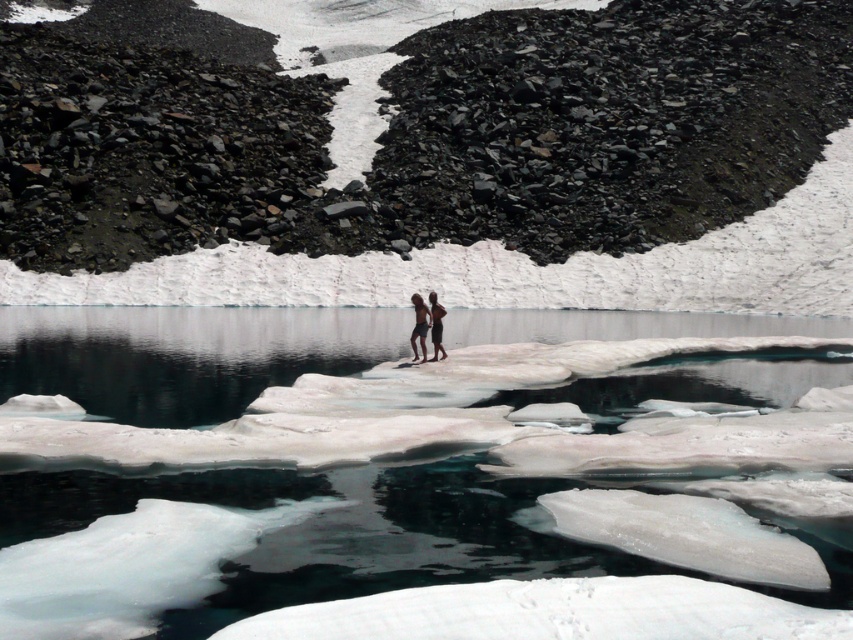
Can you confirm if clear ice at center is thinner than tan skin at center?

No, clear ice at center is not thinner than tan skin at center.

Between clear ice at center and tan skin at center, which one is positioned lower?

clear ice at center

The image size is (853, 640). I want to click on clear ice at center, so click(x=383, y=458).

Does tan skin at center appear over skinny jeans at center?

No.

Does tan skin at center have a smaller size compared to skinny jeans at center?

Actually, tan skin at center might be larger than skinny jeans at center.

Locate an element on the screen. The image size is (853, 640). tan skin at center is located at coordinates (419, 324).

Find the location of `tan skin at center`. tan skin at center is located at coordinates (419, 324).

Does clear ice at center have a lesser height compared to skinny jeans at center?

Incorrect, clear ice at center's height does not fall short of skinny jeans at center's.

Between clear ice at center and skinny jeans at center, which one has more height?

With more height is clear ice at center.

Which is in front, point (50, 410) or point (434, 308)?

Point (50, 410)

You are a GUI agent. You are given a task and a screenshot of the screen. Output one action in this format:
    pyautogui.click(x=<x>, y=<y>)
    Task: Click on the clear ice at center
    The image size is (853, 640).
    Given the screenshot: What is the action you would take?
    pyautogui.click(x=383, y=458)